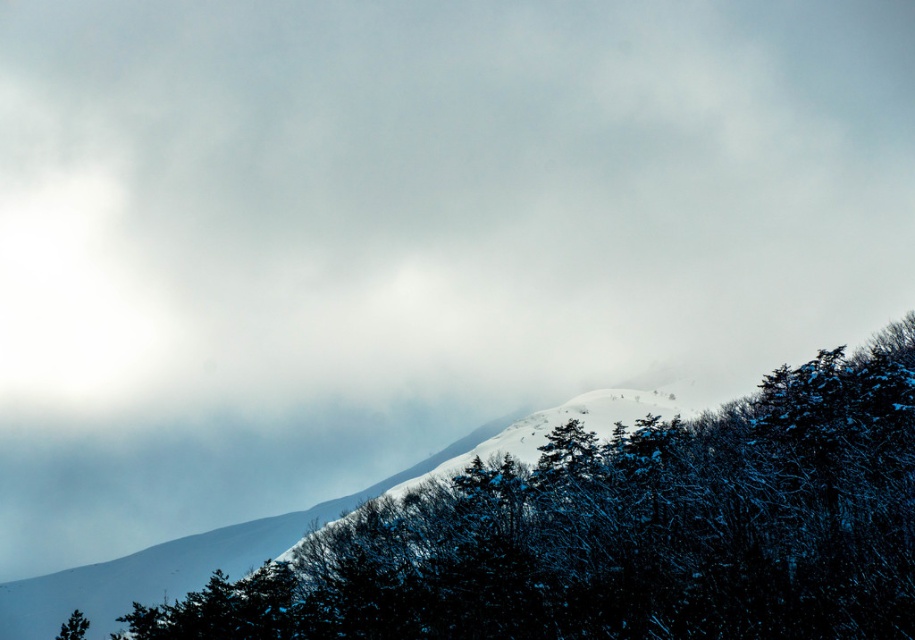
Question: Which of the following is the farthest from the observer?

Choices:
 (A) (76, 636)
 (B) (718, 419)

Answer: (B)

Question: Does snowy evergreen trees at center have a larger size compared to green matte tree at lower left?

Choices:
 (A) yes
 (B) no

Answer: (B)

Question: Which of the following is the closest to the observer?

Choices:
 (A) green matte tree at lower left
 (B) snowy evergreen trees at center

Answer: (B)

Question: Is snowy evergreen trees at center bigger than green matte tree at lower left?

Choices:
 (A) yes
 (B) no

Answer: (B)

Question: Which of the following is the closest to the observer?

Choices:
 (A) snowy evergreen trees at center
 (B) green matte tree at lower left

Answer: (A)

Question: Can you confirm if snowy evergreen trees at center is positioned to the left of green matte tree at lower left?

Choices:
 (A) no
 (B) yes

Answer: (A)